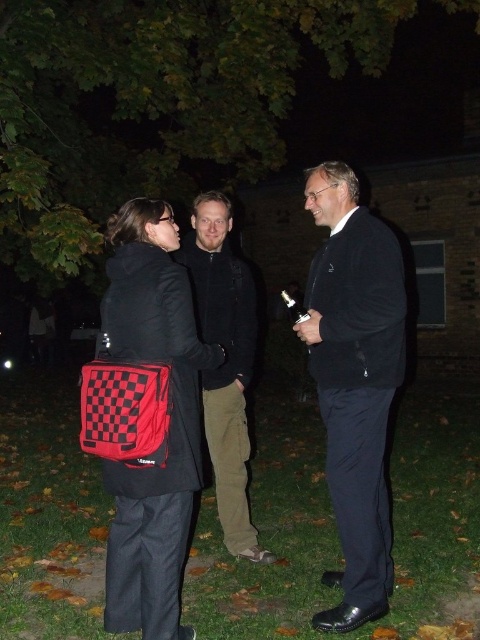
Who is shorter, matte black suit at center or checkerboard fabric bag at left?

checkerboard fabric bag at left is shorter.

Does matte black suit at center have a lesser height compared to checkerboard fabric bag at left?

No.

Locate an element on the screen. The image size is (480, 640). matte black suit at center is located at coordinates (355, 381).

Find the location of a particular element. Image resolution: width=480 pixels, height=640 pixels. matte black suit at center is located at coordinates (355, 381).

Is matte black suit at center above dark green cotton pants at center?

Yes.

Can you confirm if matte black suit at center is shorter than dark green cotton pants at center?

No.

Where is `matte black suit at center`? This screenshot has width=480, height=640. matte black suit at center is located at coordinates (355, 381).

Image resolution: width=480 pixels, height=640 pixels. In order to click on matte black suit at center in this screenshot , I will do `click(355, 381)`.

Is checkerboard fabric bag at left to the left of dark green cotton pants at center from the viewer's perspective?

Indeed, checkerboard fabric bag at left is positioned on the left side of dark green cotton pants at center.

Is point (157, 564) positioned after point (227, 460)?

No, (157, 564) is in front of (227, 460).

Who is more distant from viewer, (115, 278) or (208, 253)?

Positioned behind is point (208, 253).

This screenshot has height=640, width=480. What are the coordinates of `checkerboard fabric bag at left` in the screenshot? It's located at (169, 420).